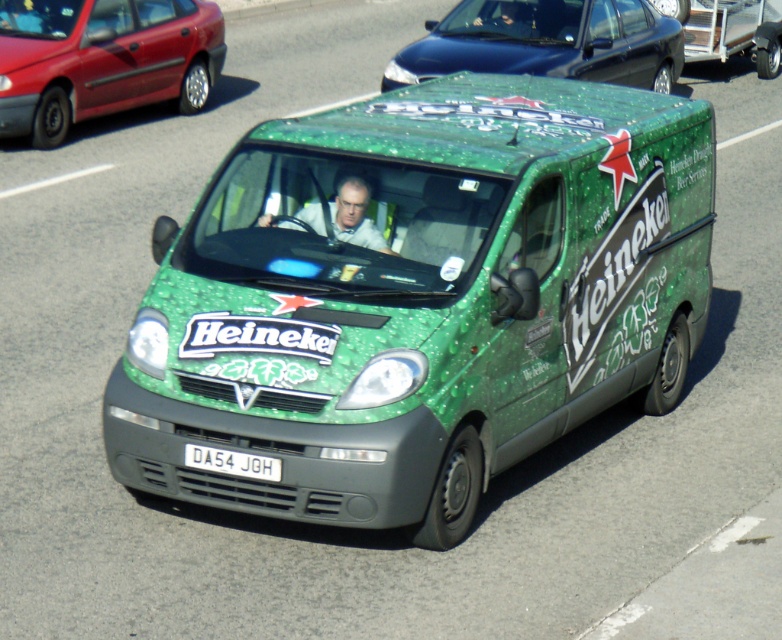
Question: Can you confirm if green matte van at center is bigger than matte white shirt at center?

Choices:
 (A) no
 (B) yes

Answer: (B)

Question: Which point is closer to the camera?

Choices:
 (A) pyautogui.click(x=210, y=19)
 (B) pyautogui.click(x=511, y=36)

Answer: (B)

Question: Which point appears farthest from the camera in this image?

Choices:
 (A) (479, 184)
 (B) (500, 12)
 (C) (772, 29)
 (D) (357, 188)

Answer: (C)

Question: Can you confirm if matte white shirt at center is wider than metallic silver wheel at upper right?

Choices:
 (A) yes
 (B) no

Answer: (A)

Question: Which of the following is the farthest from the observer?

Choices:
 (A) (659, 323)
 (B) (528, 4)

Answer: (B)

Question: Is green matte van at center to the left of metallic red sedan at upper left from the viewer's perspective?

Choices:
 (A) no
 (B) yes

Answer: (A)